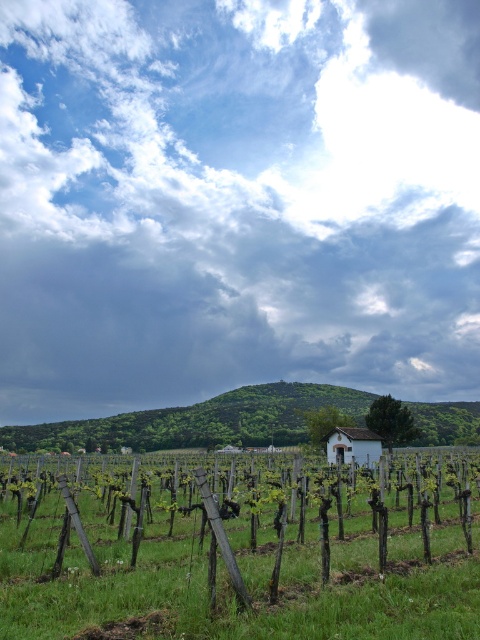
Is the position of cloudy sky at upper center more distant than that of green grassy field at center?

Yes, it is behind green grassy field at center.

At what (x,y) coordinates should I click in order to perform the action: click on cloudy sky at upper center. Please return your answer as a coordinate pair (x, y). The height and width of the screenshot is (640, 480). Looking at the image, I should click on (236, 198).

Consider the image. Is cloudy sky at upper center thinner than green leafy hillside at center?

No.

Does point (146, 10) lie in front of point (139, 422)?

No.

Does point (456, 358) come closer to viewer compared to point (219, 410)?

No, (456, 358) is further to viewer.

I want to click on cloudy sky at upper center, so click(236, 198).

Consider the image. Measure the distance between green grassy field at center and green leafy hillside at center.

green grassy field at center and green leafy hillside at center are 54.65 meters apart from each other.

Measure the distance between green grassy field at center and camera.

A distance of 5.09 meters exists between green grassy field at center and camera.

This screenshot has height=640, width=480. Describe the element at coordinates (239, 548) in the screenshot. I see `green grassy field at center` at that location.

Where is `green grassy field at center`? green grassy field at center is located at coordinates (239, 548).